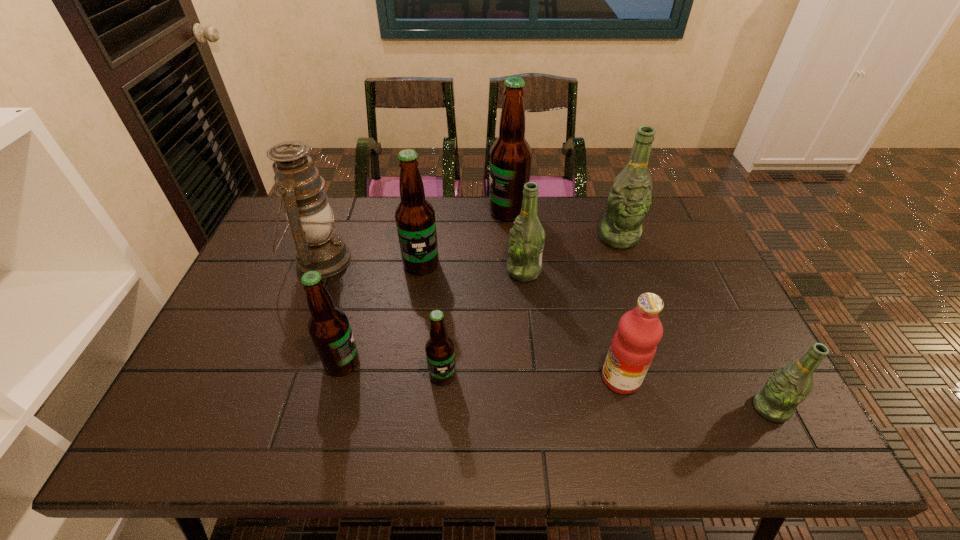
The image size is (960, 540). In order to click on the leftmost brown beer bottle in this screenshot , I will do `click(329, 328)`.

Image resolution: width=960 pixels, height=540 pixels. In order to click on fruit juice in this screenshot , I will do `click(633, 347)`.

Where is `the smallest brown beer bottle`? This screenshot has height=540, width=960. the smallest brown beer bottle is located at coordinates (440, 352).

Locate an element on the screen. The image size is (960, 540). the third beer bottle from left to right is located at coordinates (440, 352).

The height and width of the screenshot is (540, 960). What are the coordinates of `the rightmost beer bottle` in the screenshot? It's located at (789, 385).

Locate an element on the screen. Image resolution: width=960 pixels, height=540 pixels. the rightmost green beer bottle is located at coordinates click(x=789, y=385).

The height and width of the screenshot is (540, 960). In order to click on vacant area located on the label of the rightmost brown beer bottle in this screenshot , I will do `click(388, 212)`.

This screenshot has width=960, height=540. I want to click on free space located 0.200m on the label of the rightmost brown beer bottle, so click(x=431, y=212).

The height and width of the screenshot is (540, 960). I want to click on free space located 0.270m on the label of the rightmost brown beer bottle, so 411,212.

At what (x,y) coordinates should I click in order to perform the action: click on free location located on the right of the oil lamp. Please return your answer as a coordinate pair (x, y). Looking at the image, I should click on (422, 260).